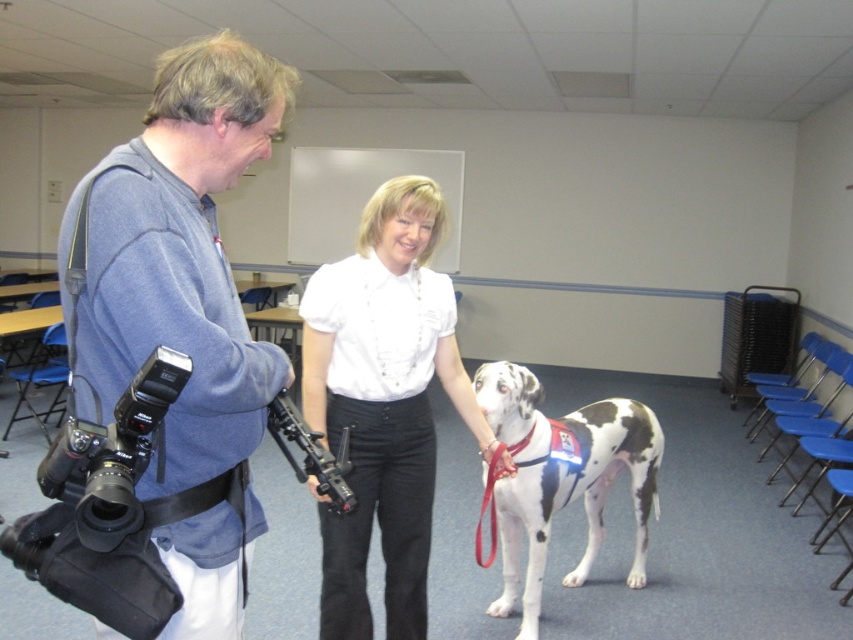
Is point (192, 125) positioned after point (566, 442)?

No, it is in front of (566, 442).

The image size is (853, 640). In order to click on matte blue jacket at left in this screenshot , I will do `click(180, 259)`.

Locate an element on the screen. The width and height of the screenshot is (853, 640). matte blue jacket at left is located at coordinates (180, 259).

Does matte blue jacket at left appear over white smooth shirt at center?

Yes, matte blue jacket at left is above white smooth shirt at center.

Which is more to the left, matte blue jacket at left or white smooth shirt at center?

From the viewer's perspective, matte blue jacket at left appears more on the left side.

Is point (279, 80) closer to viewer compared to point (389, 632)?

That is True.

I want to click on matte blue jacket at left, so click(180, 259).

From the picture: Does white smooth shirt at center appear on the right side of spotted fur dog at center?

Incorrect, white smooth shirt at center is not on the right side of spotted fur dog at center.

Which is behind, point (424, 339) or point (631, 496)?

Point (631, 496)

This screenshot has height=640, width=853. What do you see at coordinates (383, 403) in the screenshot? I see `white smooth shirt at center` at bounding box center [383, 403].

Where is `white smooth shirt at center`? The image size is (853, 640). white smooth shirt at center is located at coordinates (383, 403).